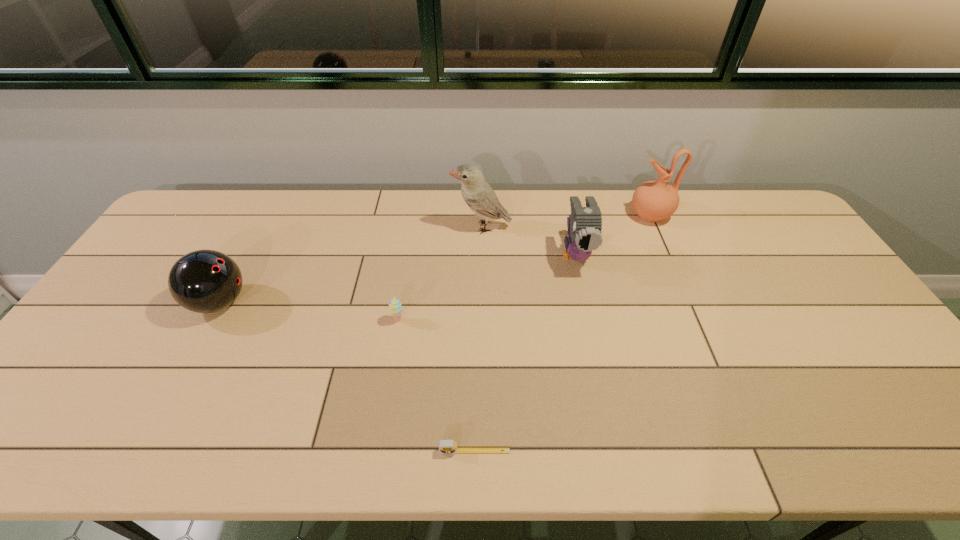
Identify the location of vacant space located on the spout of the pottery. This screenshot has height=540, width=960. (606, 215).

This screenshot has height=540, width=960. In order to click on free location located 0.300m on the spout of the pottery in this screenshot , I will do `click(542, 215)`.

This screenshot has width=960, height=540. Find the location of `free point located at the face of the taller bird`. free point located at the face of the taller bird is located at coordinates (359, 227).

Locate an element on the screen. vacant space located at the face of the taller bird is located at coordinates (430, 227).

At what (x,y) coordinates should I click in order to perform the action: click on vacant region located 0.340m at the face of the taller bird. Please return your answer as a coordinate pair (x, y). Looking at the image, I should click on (349, 227).

Locate an element on the screen. vacant position located at the beak of the shorter bird is located at coordinates (592, 330).

This screenshot has height=540, width=960. I want to click on blank area located 0.070m on the surface of the leftmost object near the finger holes, so click(275, 302).

This screenshot has width=960, height=540. I want to click on free space located on the right of the fifth object from right to left, so click(496, 320).

This screenshot has width=960, height=540. I want to click on pottery positioned at the far edge, so tap(653, 201).

Where is `object at the near edge`? object at the near edge is located at coordinates (445, 446).